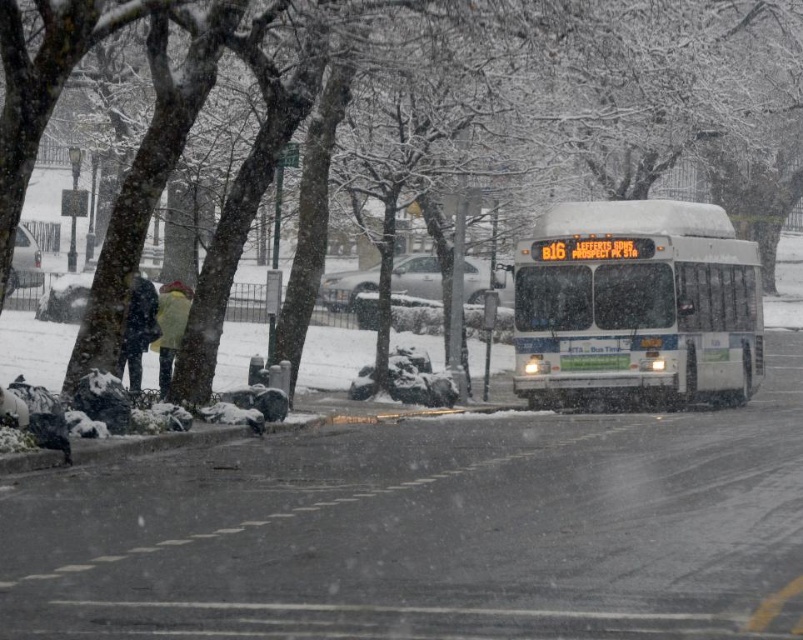
You are standing at the bus stop and see a pedestrian wearing a dark blue jacket at center. The bus is approaching the stop. If the bus is 15 meters long and the distance between you and the pedestrian is 20.83 meters, will the bus be able to fully stop before reaching the pedestrian?

The distance between you and the pedestrian wearing a dark blue jacket at center is 20.83 meters. Since the bus is 15 meters long, it needs at least 15 meters to stop completely. Therefore, the bus has enough space to stop before reaching the pedestrian.

You are a pedestrian standing at the edge of the road. You see a white matte bus at center and a dark blue jacket at center. The bus is moving towards you. If the bus is traveling at 15 km per hour, will you have enough time to cross the road safely before the bus reaches you?

The white matte bus at center is 9.85 meters away from dark blue jacket at center. At 15 km per hour, the bus would take approximately 2.5 seconds to reach the pedestrian. Since the average person takes about 3 seconds to cross a road, there is insufficient time to cross safely before the bus arrives.

You are a delivery person trying to cross the road safely. You see a dark blue jacket at center and a yellow wool coat at left. Which direction should you look first to avoid being hit by a car?

You should look to the left first because the yellow wool coat at left is narrower than the dark blue jacket at center, meaning vehicles might be closer to your left side.